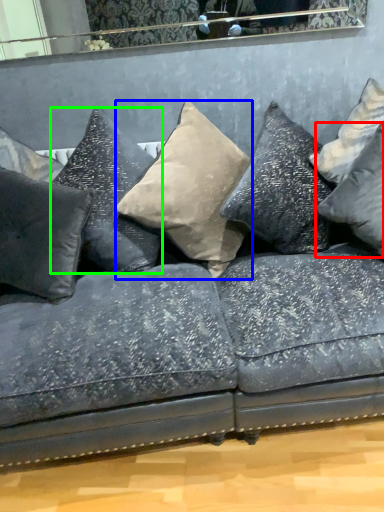
Question: Which is farther away from pillow (highlighted by a red box)? pillow (highlighted by a blue box) or pillow (highlighted by a green box)?

Choices:
 (A) pillow
 (B) pillow

Answer: (B)